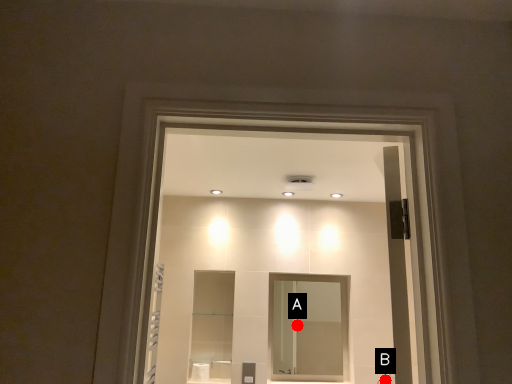
Question: Two points are circled on the image, labeled by A and B beside each circle. Which point is closer to the camera?

Choices:
 (A) A is closer
 (B) B is closer

Answer: (B)